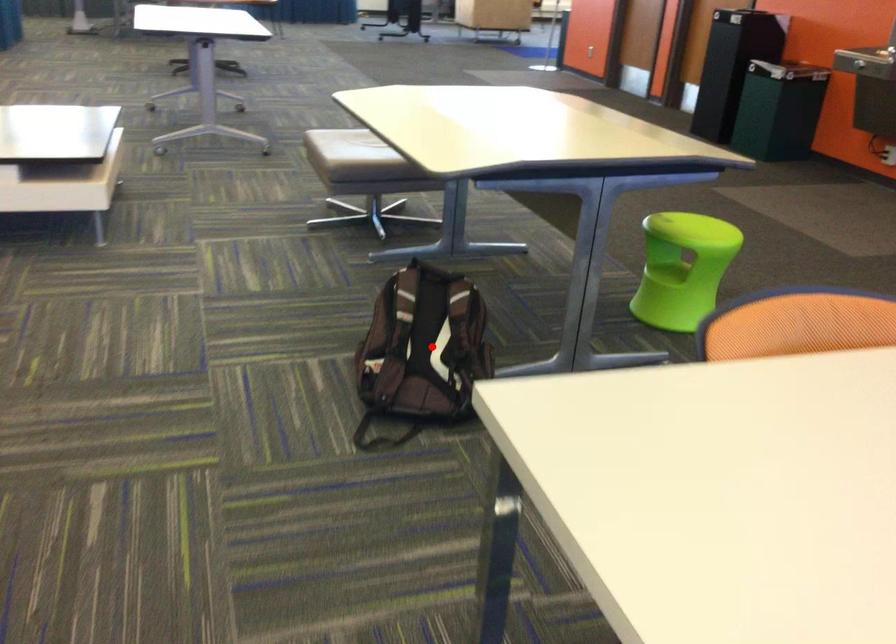
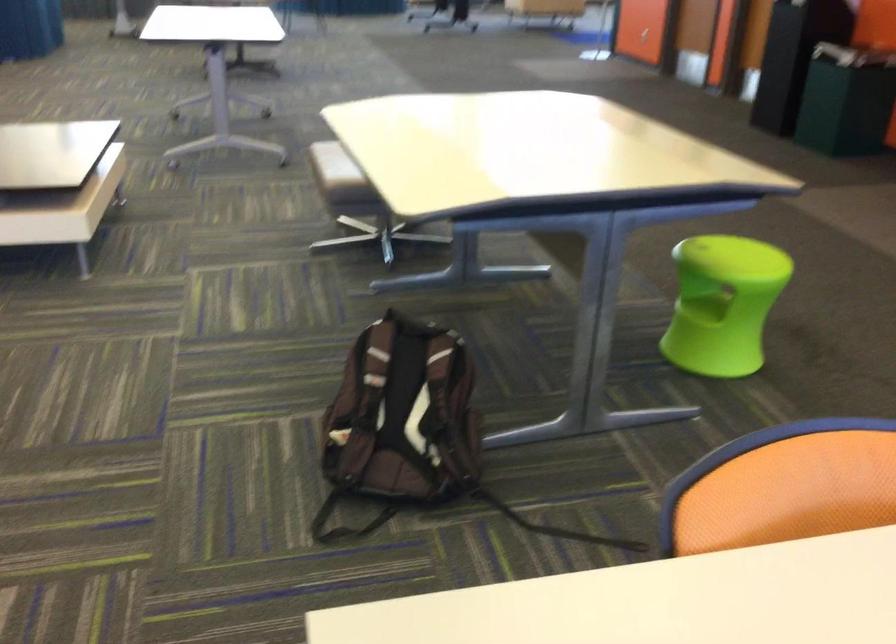
Question: I am providing you with two images of the same scene from different viewpoints. Image1 has a red point marked. In image2, the corresponding 3D location appears at what relative position? Reply with the corresponding letter.

Choices:
 (A) Closer
 (B) Farther

Answer: (A)